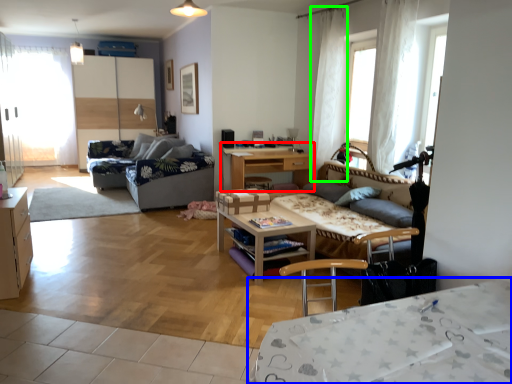
Question: Considering the real-world distances, which object is closest to table (highlighted by a red box)? desk (highlighted by a blue box) or curtain (highlighted by a green box).

Choices:
 (A) desk
 (B) curtain

Answer: (B)